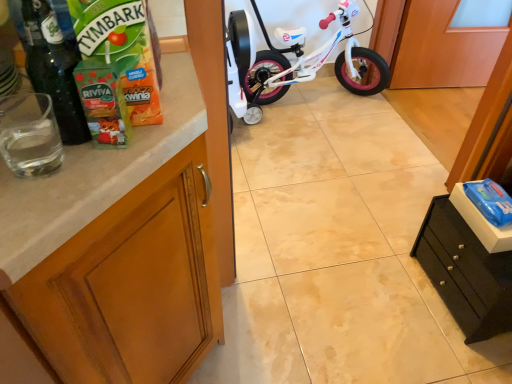
The width and height of the screenshot is (512, 384). Find the location of `free spot in front of white glossy bicycle at center`. free spot in front of white glossy bicycle at center is located at coordinates (324, 161).